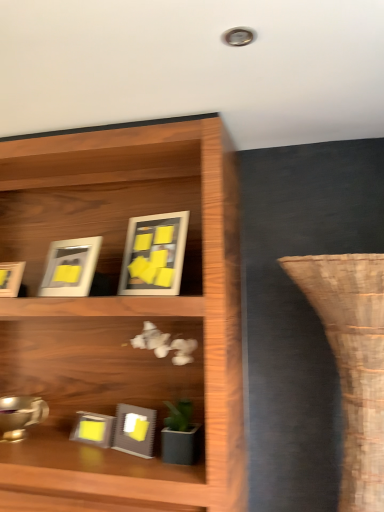
Question: Is matte gray picture frame at center, which appears as the 4th picture frame when viewed from the top, turned away from matte gray picture frame at lower left, which is the 5th picture frame from top to bottom?

Choices:
 (A) no
 (B) yes

Answer: (A)

Question: From the image's perspective, is matte gray picture frame at center, arranged as the second picture frame when ordered from the bottom, beneath matte gray picture frame at lower left, which is the first picture frame from bottom to top?

Choices:
 (A) no
 (B) yes

Answer: (A)

Question: Does matte gray picture frame at center, which appears as the 4th picture frame when viewed from the top, turn towards matte gray picture frame at lower left, which is the 5th picture frame from top to bottom?

Choices:
 (A) yes
 (B) no

Answer: (B)

Question: From the image's perspective, would you say matte gray picture frame at center, which appears as the 4th picture frame when viewed from the top, is positioned over matte gray picture frame at lower left, which is the first picture frame from bottom to top?

Choices:
 (A) no
 (B) yes

Answer: (B)

Question: Is matte gray picture frame at center, which appears as the 4th picture frame when viewed from the top, in front of matte gray picture frame at lower left, which is the 5th picture frame from top to bottom?

Choices:
 (A) yes
 (B) no

Answer: (A)

Question: Are matte gray picture frame at center, which appears as the 4th picture frame when viewed from the top, and matte gray picture frame at lower left, which is the first picture frame from bottom to top, beside each other?

Choices:
 (A) no
 (B) yes

Answer: (A)

Question: Is brown woven vase at right shorter than matte white picture frame at left, which ranks as the third picture frame in bottom-to-top order?

Choices:
 (A) no
 (B) yes

Answer: (A)

Question: From a real-world perspective, is brown woven vase at right under matte white picture frame at left, which ranks as the third picture frame in bottom-to-top order?

Choices:
 (A) no
 (B) yes

Answer: (B)

Question: Does brown woven vase at right touch matte white picture frame at left, which ranks as the third picture frame in bottom-to-top order?

Choices:
 (A) yes
 (B) no

Answer: (B)

Question: Is brown woven vase at right at the right side of matte white picture frame at left, which is counted as the 3th picture frame, starting from the top?

Choices:
 (A) no
 (B) yes

Answer: (B)

Question: Can you confirm if brown woven vase at right is taller than matte white picture frame at left, which is counted as the 3th picture frame, starting from the top?

Choices:
 (A) yes
 (B) no

Answer: (A)

Question: Is brown woven vase at right bigger than matte white picture frame at left, which is counted as the 3th picture frame, starting from the top?

Choices:
 (A) no
 (B) yes

Answer: (B)

Question: Is matte gray picture frame at center, which appears as the 4th picture frame when viewed from the top, wider than matte white picture frame at upper left, which ranks as the second picture frame in top-to-bottom order?

Choices:
 (A) no
 (B) yes

Answer: (B)